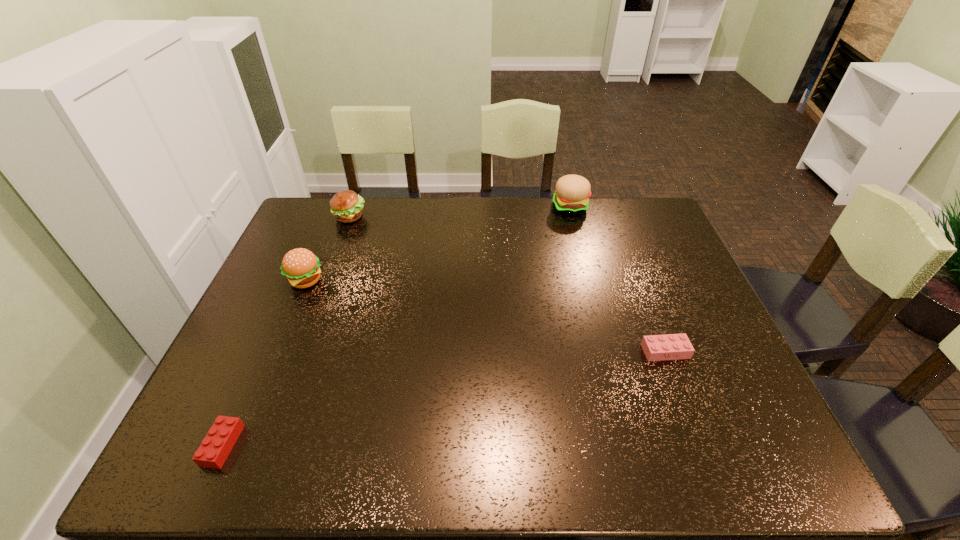
This screenshot has width=960, height=540. Identify the location of vacant position in the image that satisfies the following two spatial constraints: 1. on the front side of the rightmost hamburger; 2. on the right side of the second nearest object. (609, 352).